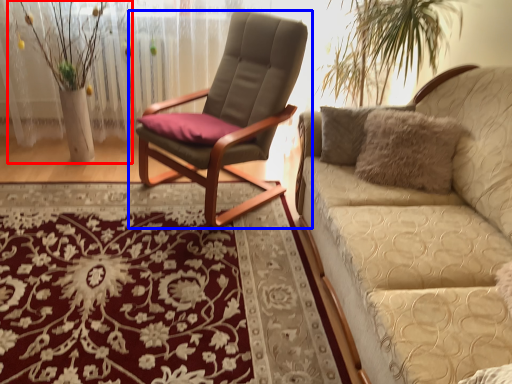
Question: Which of the following is the farthest to the observer, floral arrangement (highlighted by a red box) or chair (highlighted by a blue box)?

Choices:
 (A) floral arrangement
 (B) chair

Answer: (A)